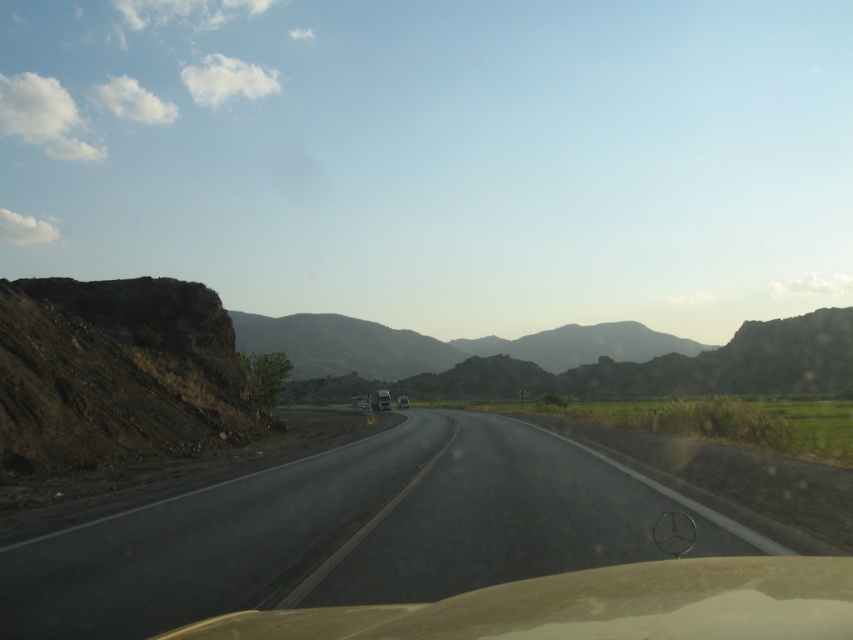
Consider the image. You are driving a car and want to check the road condition ahead. Since you can only see through the transparent beige car window at center, can you see the asphalt road at center clearly?

The asphalt road at center is positioned under the transparent beige car window at center, so yes, you can see the asphalt road at center clearly through the transparent beige car window at center.

You are a passenger in a car and want to know which object in the scene takes up more space in your view. Based on the asphalt road at center and the transparent beige car window at center, which one appears bigger?

The asphalt road at center appears bigger than the transparent beige car window at center because it is larger in size.

You are a driver navigating a winding road. Your GPS shows a point at coordinates (421, 552). Based on the scene description, where is this point located?

The point at coordinates (421, 552) is located on the asphalt road at center, as indicated by the description.